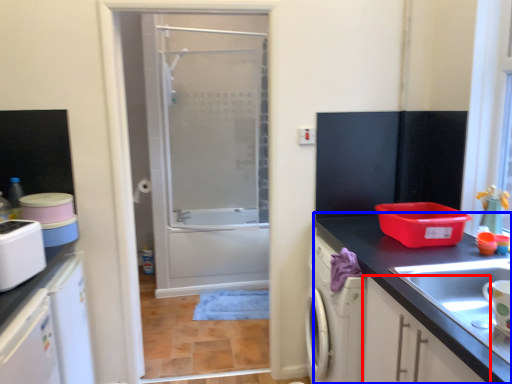
Question: Which object is closer to the camera taking this photo, cabinetry (highlighted by a red box) or countertop (highlighted by a blue box)?

Choices:
 (A) cabinetry
 (B) countertop

Answer: (A)